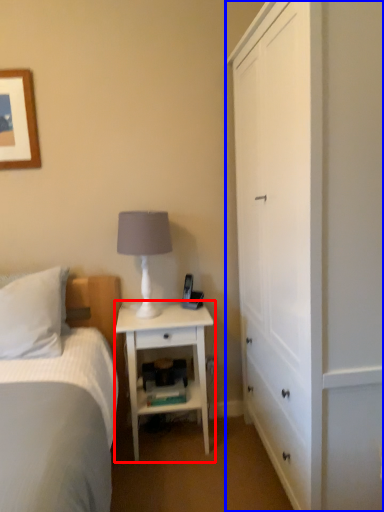
Question: Which of the following is the closest to the observer, nightstand (highlighted by a red box) or cabinetry (highlighted by a blue box)?

Choices:
 (A) nightstand
 (B) cabinetry

Answer: (B)